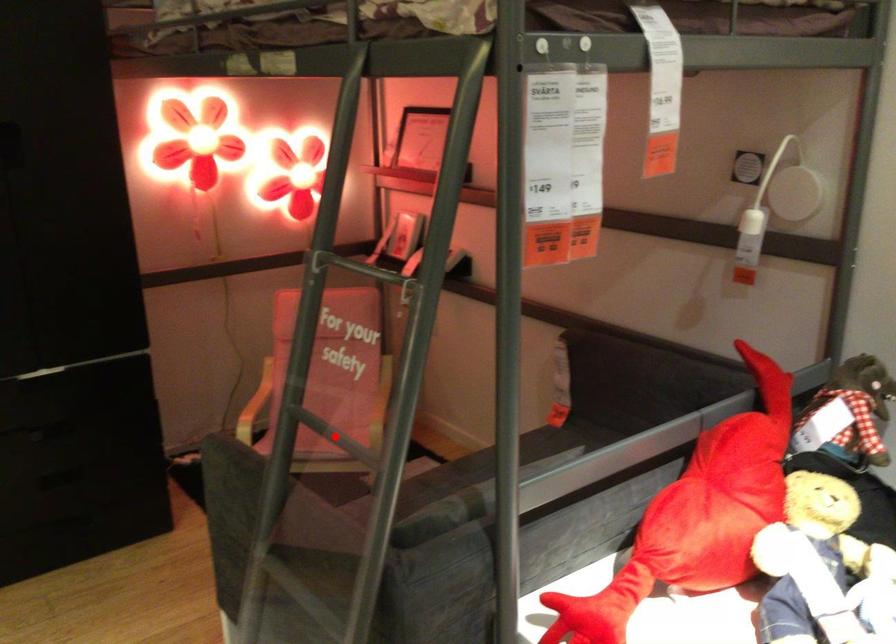
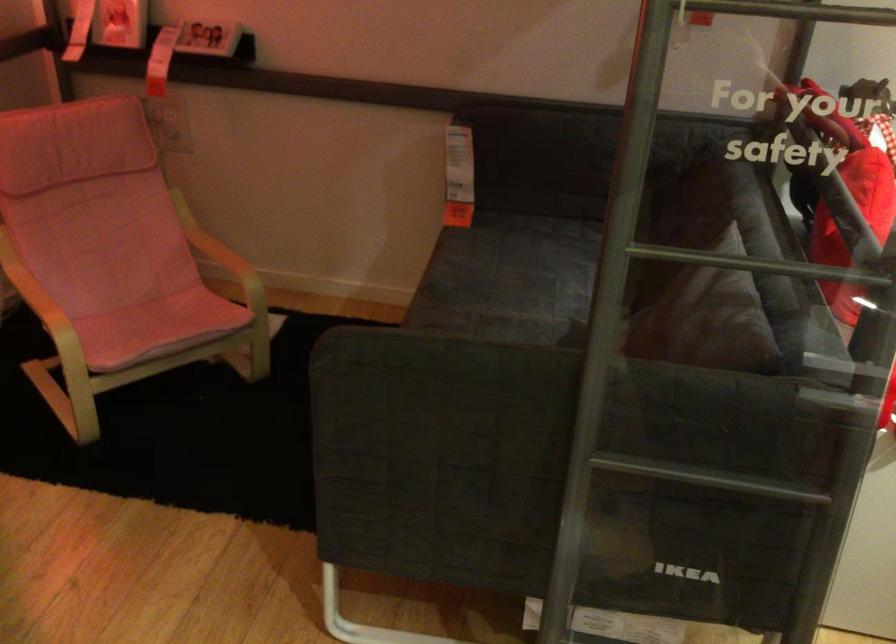
Question: I am providing you with two images of the same scene from different viewpoints. A red point is shown in image1. For the corresponding object point in image2, is it positioned nearer or farther from the camera?

Choices:
 (A) Nearer
 (B) Farther

Answer: (A)